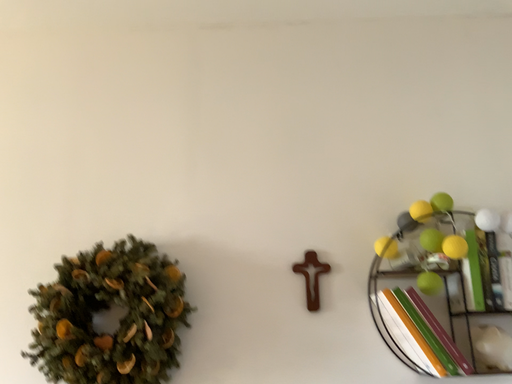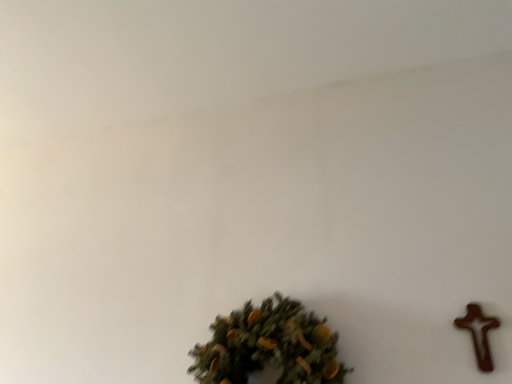
Question: How did the camera likely rotate when shooting the video?

Choices:
 (A) rotated left
 (B) rotated right

Answer: (A)